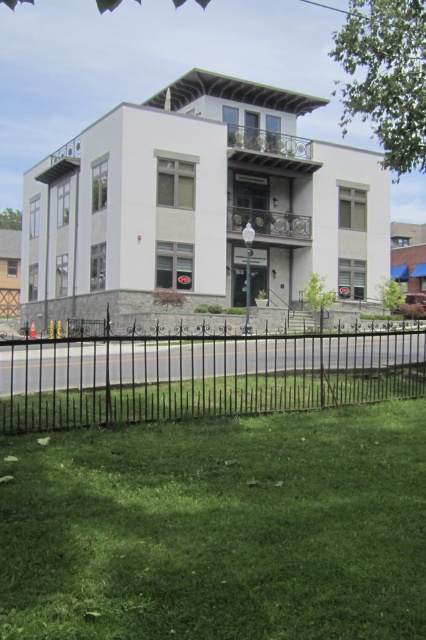
You are standing in front of the modern two story building and see the green grass at lower center and the black wrought iron fence at lower center. Which object is located to the right of the other?

The green grass at lower center is positioned on the right side of black wrought iron fence at lower center.